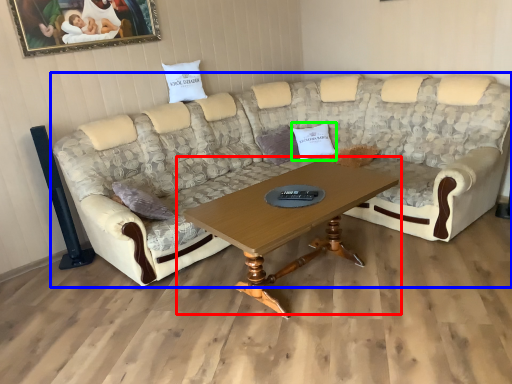
Question: Which object is positioned closest to coffee table (highlighted by a red box)? Select from studio couch (highlighted by a blue box) and pillow (highlighted by a green box).

Choices:
 (A) studio couch
 (B) pillow

Answer: (A)